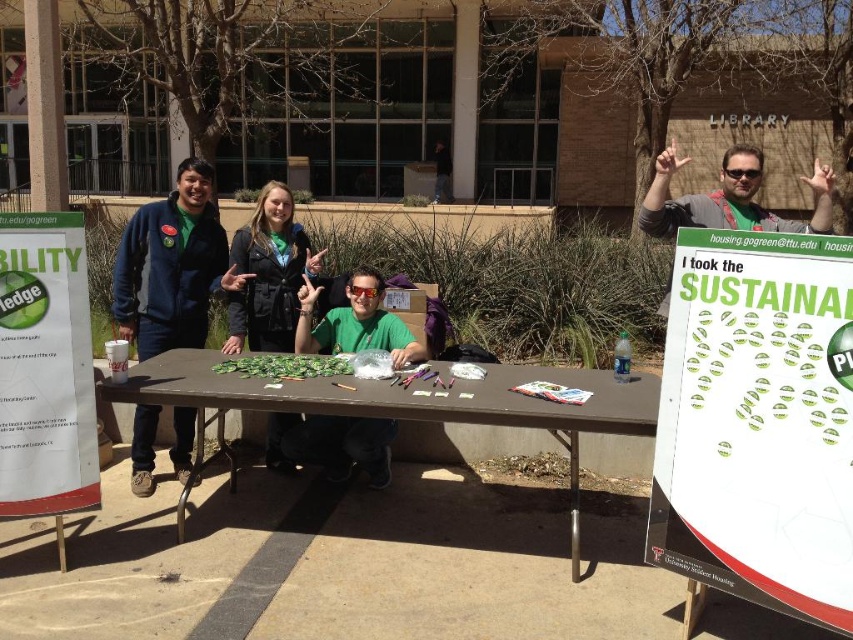
Question: Does green matte shirt at center come in front of matte green t-shirt at upper right?

Choices:
 (A) no
 (B) yes

Answer: (A)

Question: Among these points, which one is farthest from the camera?

Choices:
 (A) (685, 221)
 (B) (671, 337)

Answer: (A)

Question: From the image, what is the correct spatial relationship of green fabric jacket at center in relation to matte green t-shirt at upper right?

Choices:
 (A) below
 (B) above

Answer: (A)

Question: Which point appears farthest from the camera in this image?

Choices:
 (A) (717, 476)
 (B) (350, 308)

Answer: (B)

Question: Which point is farther to the camera?

Choices:
 (A) (590, 432)
 (B) (337, 321)
 (C) (166, 269)

Answer: (B)

Question: Is green paper sign at center right to the left of matte green t-shirt at upper right from the viewer's perspective?

Choices:
 (A) yes
 (B) no

Answer: (A)